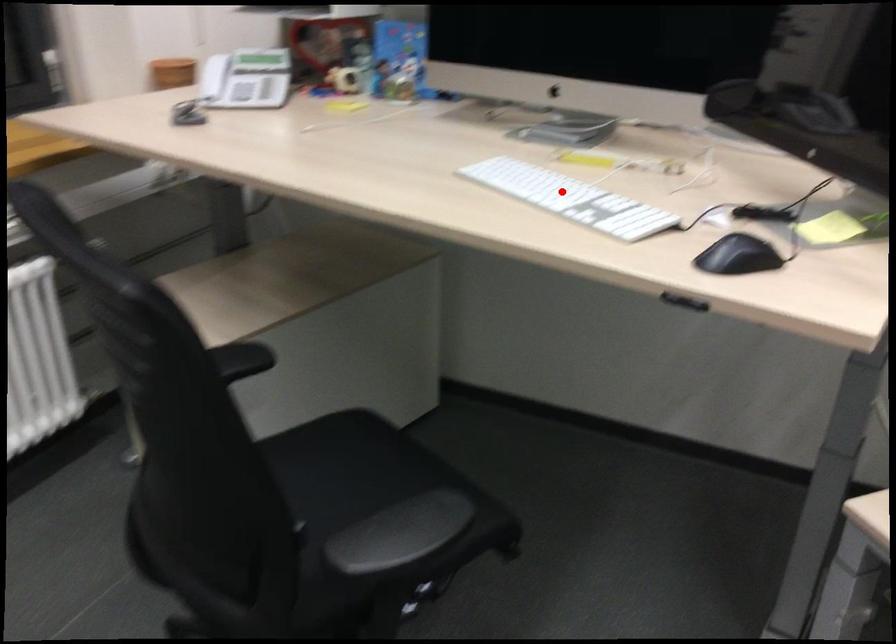
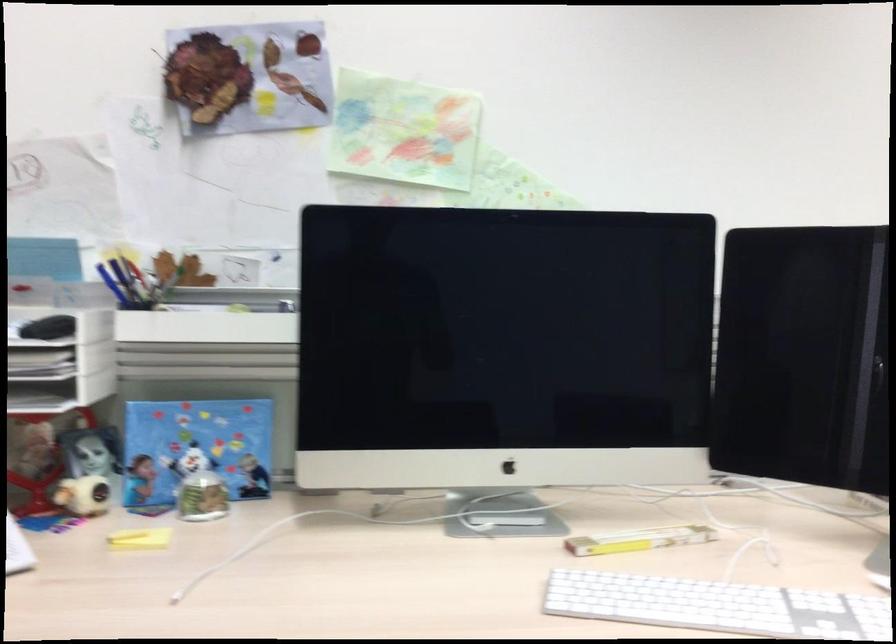
The point at the highlighted location is marked in the first image. Where is the corresponding point in the second image?

(717, 605)